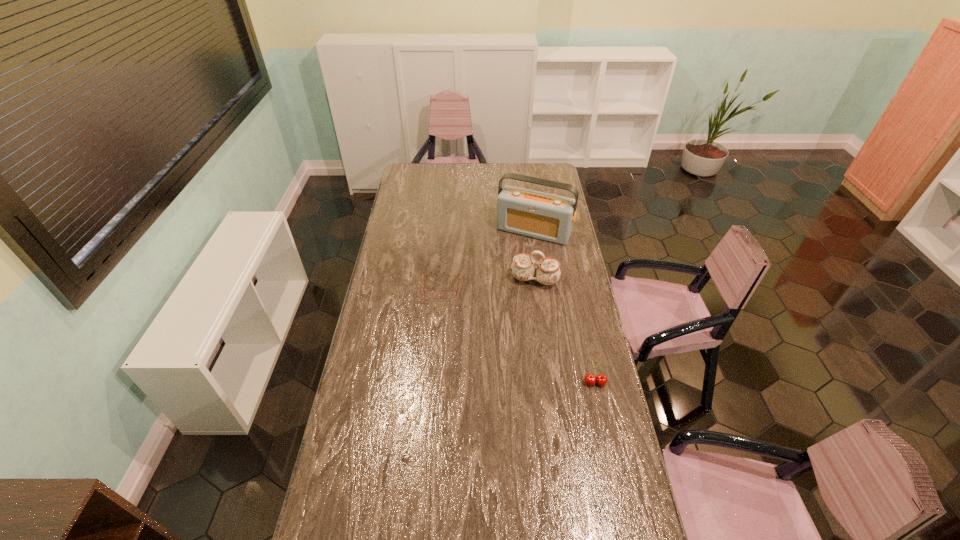
This screenshot has height=540, width=960. In order to click on the shortest object in this screenshot , I will do `click(428, 294)`.

Identify the location of spectacles. The height and width of the screenshot is (540, 960). (428, 294).

The height and width of the screenshot is (540, 960). In order to click on the nearest object in this screenshot , I will do coord(601,379).

Find the location of a particular element. This screenshot has width=960, height=540. cherry is located at coordinates (601, 379).

Where is `the second tallest object`? the second tallest object is located at coordinates (548, 272).

What are the coordinates of `the farthest object` in the screenshot? It's located at (544, 216).

Find the location of a particular element. radio receiver is located at coordinates (544, 216).

Locate an element on the screen. This screenshot has height=540, width=960. free spot located on the lenses of the leftmost object is located at coordinates (437, 340).

Find the location of a particular element. Image resolution: width=960 pixels, height=540 pixels. vacant space located with the stems of the nearest object pointing upwards is located at coordinates (619, 495).

At what (x,y) coordinates should I click in order to perform the action: click on free space located 0.180m by the handle of the third shortest object. Please return your answer as a coordinate pair (x, y). Looking at the image, I should click on (523, 321).